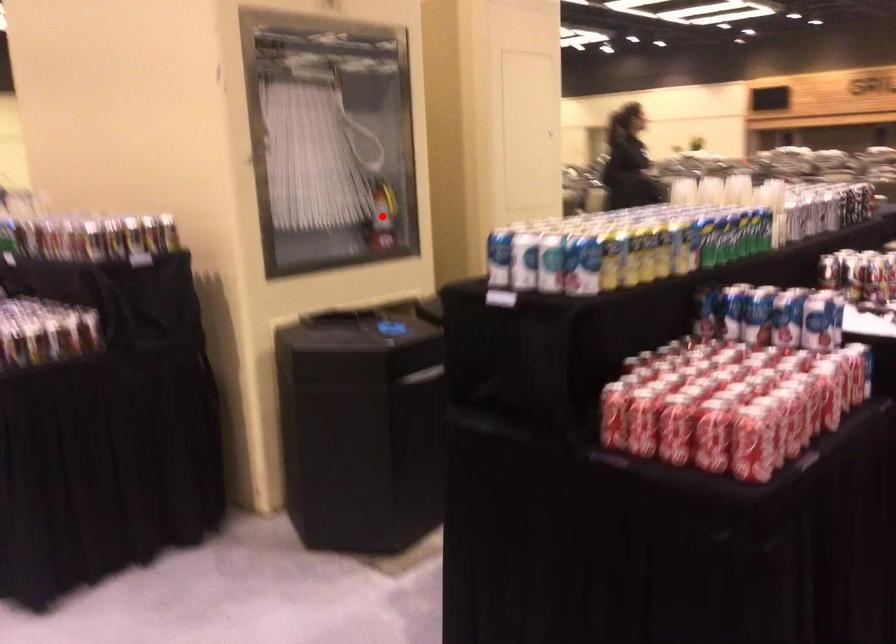
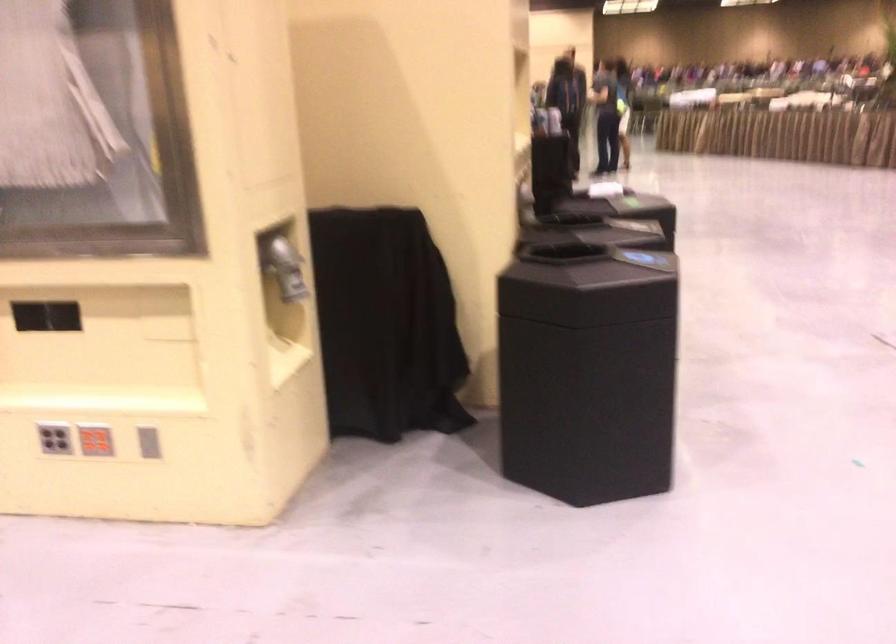
Question: I am providing you with two images of the same scene from different viewpoints. A red point is marked on the first image. Can you still see the location of the red point in image 2?

Choices:
 (A) Yes
 (B) No

Answer: (B)